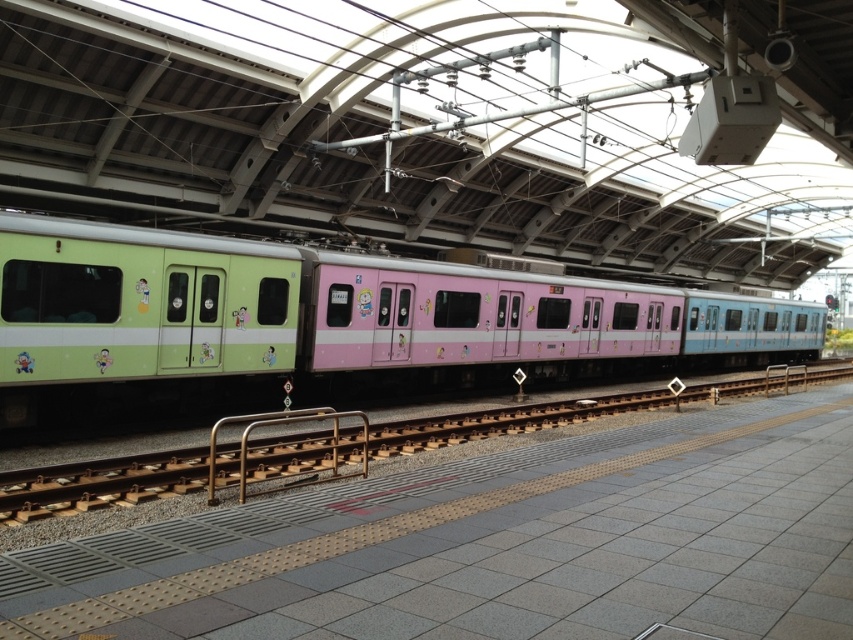
Who is shorter, green matte rail at left or brown metallic rail at center?

brown metallic rail at center is shorter.

Who is more distant from viewer, [654,396] or [277,413]?

The point [654,396] is more distant.

Which is behind, point (270, 467) or point (363, 460)?

The point (270, 467) is behind.

Identify the location of green matte rail at left. (99, 483).

Looking at this image, can you confirm if pastel matte train at center is positioned below green matte rail at left?

Actually, pastel matte train at center is above green matte rail at left.

The height and width of the screenshot is (640, 853). What do you see at coordinates (334, 314) in the screenshot?
I see `pastel matte train at center` at bounding box center [334, 314].

Does point (612, 369) come behind point (115, 456)?

Yes, it is behind point (115, 456).

Find the location of a particular element. The image size is (853, 640). pastel matte train at center is located at coordinates (334, 314).

Is point (132, 280) closer to viewer compared to point (207, 481)?

No, it is not.

Can you confirm if pastel matte train at center is thinner than brown metallic rail at center?

No.

Is point (213, 364) farther from camera compared to point (252, 428)?

No, (213, 364) is closer to viewer.

Locate an element on the screen. The height and width of the screenshot is (640, 853). pastel matte train at center is located at coordinates (334, 314).